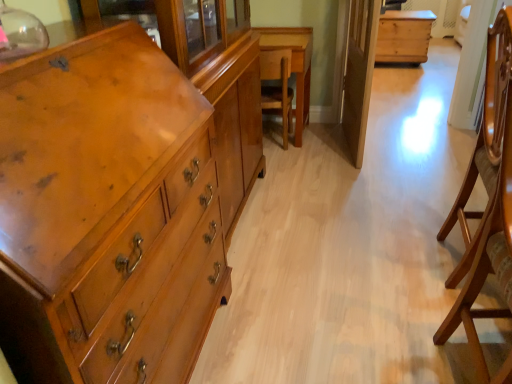
Question: From a real-world perspective, is wooden chair at center, the 1th armchair from the back, over matte wood chest of drawers at left?

Choices:
 (A) yes
 (B) no

Answer: (B)

Question: Is wooden chair at center, which appears as the 2th armchair when ordered from the bottom, wider than matte wood chest of drawers at left?

Choices:
 (A) no
 (B) yes

Answer: (A)

Question: Is wooden chair at center, which is the 1th armchair in left-to-right order, smaller than matte wood chest of drawers at left?

Choices:
 (A) no
 (B) yes

Answer: (B)

Question: From the image's perspective, is wooden chair at center, which appears as the 2th armchair when ordered from the bottom, on top of matte wood chest of drawers at left?

Choices:
 (A) no
 (B) yes

Answer: (B)

Question: Is wooden chair at center, which is the 1th armchair in top-to-bottom order, thinner than matte wood chest of drawers at left?

Choices:
 (A) yes
 (B) no

Answer: (A)

Question: Considering the relative positions of wooden chair at center, acting as the second armchair starting from the front, and matte wood chest of drawers at left in the image provided, is wooden chair at center, acting as the second armchair starting from the front, to the right of matte wood chest of drawers at left from the viewer's perspective?

Choices:
 (A) yes
 (B) no

Answer: (A)

Question: From the image's perspective, is wooden table at center, which is counted as the 2th table, starting from the top, beneath natural wood chest at center, which is counted as the 1th table, starting from the top?

Choices:
 (A) yes
 (B) no

Answer: (A)

Question: Is wooden table at center, which is the 2th table from right to left, positioned behind natural wood chest at center, which appears as the 1th table when viewed from the back?

Choices:
 (A) yes
 (B) no

Answer: (B)

Question: Considering the relative sizes of wooden table at center, the 2th table in the back-to-front sequence, and natural wood chest at center, which is the 2th table in front-to-back order, in the image provided, is wooden table at center, the 2th table in the back-to-front sequence, smaller than natural wood chest at center, which is the 2th table in front-to-back order,?

Choices:
 (A) yes
 (B) no

Answer: (B)

Question: Is wooden table at center, which is the 2th table from right to left, not close to natural wood chest at center, which appears as the 1th table when viewed from the back?

Choices:
 (A) yes
 (B) no

Answer: (A)

Question: Could natural wood chest at center, which is counted as the 1th table, starting from the top, be considered to be inside wooden table at center, arranged as the 1th table when viewed from the left?

Choices:
 (A) no
 (B) yes

Answer: (A)

Question: Considering the relative sizes of wooden table at center, which is the 1th table from bottom to top, and natural wood chest at center, which is counted as the 1th table, starting from the top, in the image provided, is wooden table at center, which is the 1th table from bottom to top, thinner than natural wood chest at center, which is counted as the 1th table, starting from the top,?

Choices:
 (A) no
 (B) yes

Answer: (A)

Question: Can you confirm if wooden table at center, the 2th table in the back-to-front sequence, is positioned to the right of wooden armchair at right, marked as the 2th armchair in a top-to-bottom arrangement?

Choices:
 (A) no
 (B) yes

Answer: (A)